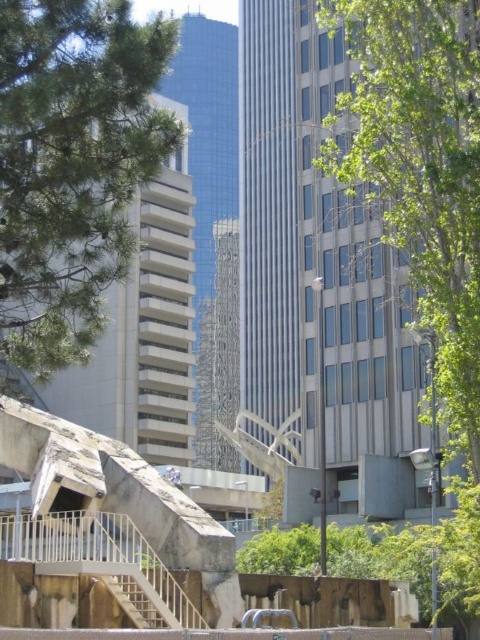
Between green leafy tree at center and brown wooden stairs at lower left, which one has less height?

brown wooden stairs at lower left is shorter.

Can you confirm if green leafy tree at center is smaller than brown wooden stairs at lower left?

Actually, green leafy tree at center might be larger than brown wooden stairs at lower left.

Does point (394, 387) come in front of point (172, 624)?

That is False.

The height and width of the screenshot is (640, 480). Identify the location of green leafy tree at center. (349, 225).

Is green leafy tree at left to the left of brown wooden stairs at lower left from the viewer's perspective?

Indeed, green leafy tree at left is positioned on the left side of brown wooden stairs at lower left.

Can you confirm if green leafy tree at left is bigger than brown wooden stairs at lower left?

Yes, green leafy tree at left is bigger than brown wooden stairs at lower left.

Does point (108, 192) come in front of point (112, 580)?

Yes, point (108, 192) is closer to viewer.

At what (x,y) coordinates should I click in order to perform the action: click on green leafy tree at left. Please return your answer as a coordinate pair (x, y). The width and height of the screenshot is (480, 640). Looking at the image, I should click on (72, 164).

Can you confirm if green leafy tree at center is smaller than green leafy tree at left?

No, green leafy tree at center is not smaller than green leafy tree at left.

Between green leafy tree at center and green leafy tree at left, which one has less height?

green leafy tree at left is shorter.

Is point (432, 61) less distant than point (103, 136)?

That is False.

I want to click on green leafy tree at center, so click(349, 225).